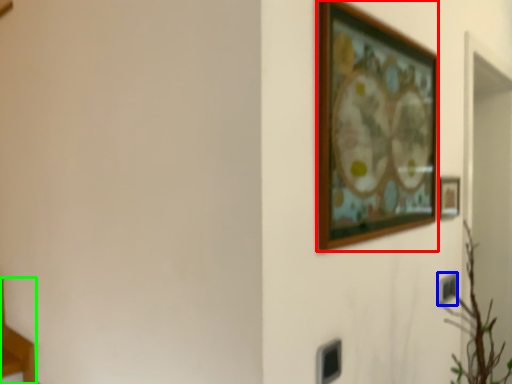
Question: Based on their relative distances, which object is farther from picture frame (highlighted by a red box)? Choose from electric outlet (highlighted by a blue box) and furniture (highlighted by a green box).

Choices:
 (A) electric outlet
 (B) furniture

Answer: (B)